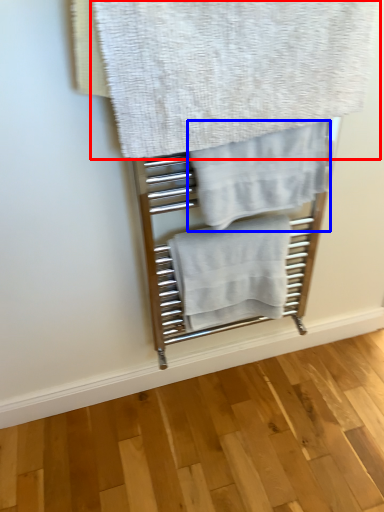
Question: Which object is further to the camera taking this photo, towel (highlighted by a red box) or towel (highlighted by a blue box)?

Choices:
 (A) towel
 (B) towel

Answer: (B)